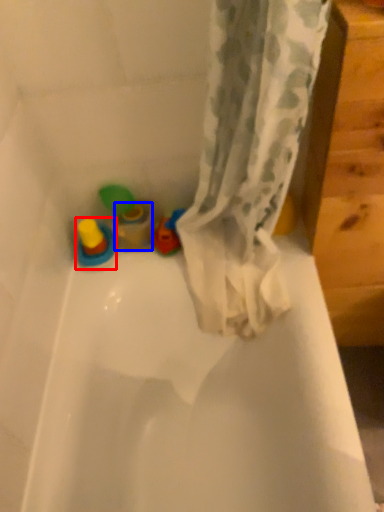
Question: Among these objects, which one is farthest to the camera, toy (highlighted by a red box) or toy (highlighted by a blue box)?

Choices:
 (A) toy
 (B) toy

Answer: (B)